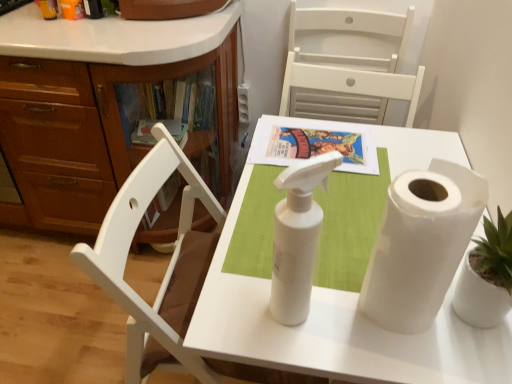
Question: Considering the relative sizes of matte paper book at center and white matte chair at upper center in the image provided, is matte paper book at center thinner than white matte chair at upper center?

Choices:
 (A) no
 (B) yes

Answer: (A)

Question: Is the depth of matte paper book at center greater than that of white matte chair at upper center?

Choices:
 (A) no
 (B) yes

Answer: (A)

Question: Is matte paper book at center looking in the opposite direction of white matte chair at upper center?

Choices:
 (A) no
 (B) yes

Answer: (A)

Question: Does matte paper book at center have a lesser height compared to white matte chair at upper center?

Choices:
 (A) yes
 (B) no

Answer: (A)

Question: Considering the relative sizes of matte paper book at center and white matte chair at upper center in the image provided, is matte paper book at center bigger than white matte chair at upper center?

Choices:
 (A) yes
 (B) no

Answer: (B)

Question: Considering the positions of white matte spray bottle at center and white paper at right in the image, is white matte spray bottle at center wider or thinner than white paper at right?

Choices:
 (A) thin
 (B) wide

Answer: (A)

Question: Is white matte spray bottle at center to the left or to the right of white paper at right in the image?

Choices:
 (A) left
 (B) right

Answer: (A)

Question: Is white matte spray bottle at center taller or shorter than white paper at right?

Choices:
 (A) tall
 (B) short

Answer: (A)

Question: From a real-world perspective, is white matte spray bottle at center above or below white paper at right?

Choices:
 (A) above
 (B) below

Answer: (A)

Question: Considering the positions of matte paper book at center and white matte paper towel roll at center in the image, is matte paper book at center bigger or smaller than white matte paper towel roll at center?

Choices:
 (A) big
 (B) small

Answer: (B)

Question: In terms of height, does matte paper book at center look taller or shorter compared to white matte paper towel roll at center?

Choices:
 (A) short
 (B) tall

Answer: (A)

Question: Considering the positions of point [x=360, y=130] and point [x=417, y=137], is point [x=360, y=130] closer or farther from the camera than point [x=417, y=137]?

Choices:
 (A) closer
 (B) farther

Answer: (A)

Question: In the image, is matte paper book at center positioned in front of or behind white matte paper towel roll at center?

Choices:
 (A) front
 (B) behind

Answer: (B)

Question: Is white matte chair at upper center to the left or to the right of white matte paper towel roll at center in the image?

Choices:
 (A) right
 (B) left

Answer: (A)

Question: Is white matte chair at upper center in front of or behind white matte paper towel roll at center in the image?

Choices:
 (A) front
 (B) behind

Answer: (B)